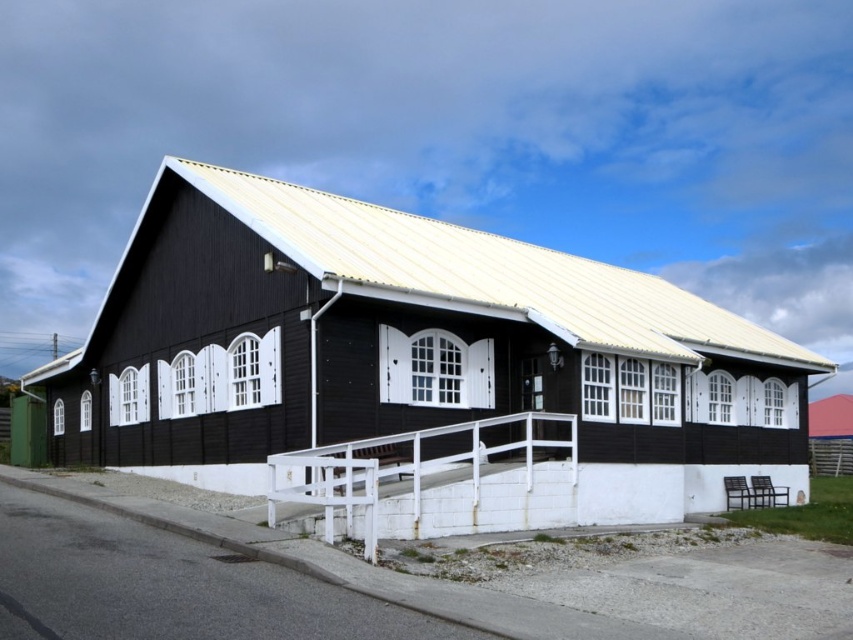
Question: Which point is farther to the camera?

Choices:
 (A) (701, 337)
 (B) (563, 417)

Answer: (A)

Question: Does black wood house at center have a greater width compared to white painted wood rail at center?

Choices:
 (A) yes
 (B) no

Answer: (A)

Question: Can you confirm if black wood house at center is positioned to the right of white painted wood rail at center?

Choices:
 (A) no
 (B) yes

Answer: (B)

Question: Which point is farther to the camera?

Choices:
 (A) black wood house at center
 (B) white painted wood rail at center

Answer: (A)

Question: Which object appears farthest from the camera in this image?

Choices:
 (A) black wood house at center
 (B) white painted wood rail at center

Answer: (A)

Question: Does black wood house at center lie behind white painted wood rail at center?

Choices:
 (A) no
 (B) yes

Answer: (B)